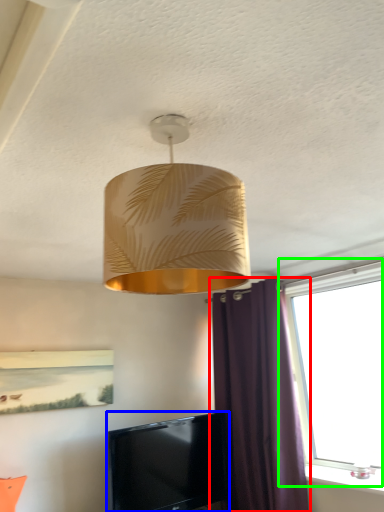
Question: Based on their relative distances, which object is nearer to curtain (highlighted by a red box)? Choose from television (highlighted by a blue box) and window (highlighted by a green box).

Choices:
 (A) television
 (B) window

Answer: (B)